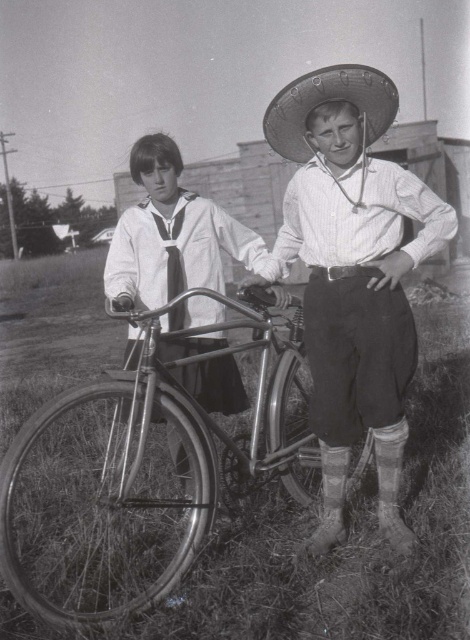
Which is more to the left, white striped shirt at center or shiny chrome bicycle at center?

shiny chrome bicycle at center

Between white striped shirt at center and shiny chrome bicycle at center, which one is positioned lower?

Positioned lower is shiny chrome bicycle at center.

Who is more distant from viewer, (321, 140) or (23, 436)?

Point (321, 140)

Locate an element on the screen. The height and width of the screenshot is (640, 470). white striped shirt at center is located at coordinates (352, 275).

Between smooth fabric sailor suit at center and woven straw sombrero at center, which one is positioned lower?

smooth fabric sailor suit at center

Which is more to the right, smooth fabric sailor suit at center or woven straw sombrero at center?

Positioned to the right is woven straw sombrero at center.

Who is more distant from viewer, (169, 444) or (312, 88)?

The point (169, 444) is behind.

This screenshot has width=470, height=640. I want to click on smooth fabric sailor suit at center, so click(171, 234).

Who is positioned more to the left, shiny chrome bicycle at center or satin necktie at center?

shiny chrome bicycle at center

Is point (179, 504) less distant than point (175, 257)?

Yes, it is in front of point (175, 257).

Is point (155, 394) farther from camera compared to point (172, 237)?

That is False.

At what (x,y) coordinates should I click in order to perform the action: click on shiny chrome bicycle at center. Please return your answer as a coordinate pair (x, y). Looking at the image, I should click on (139, 470).